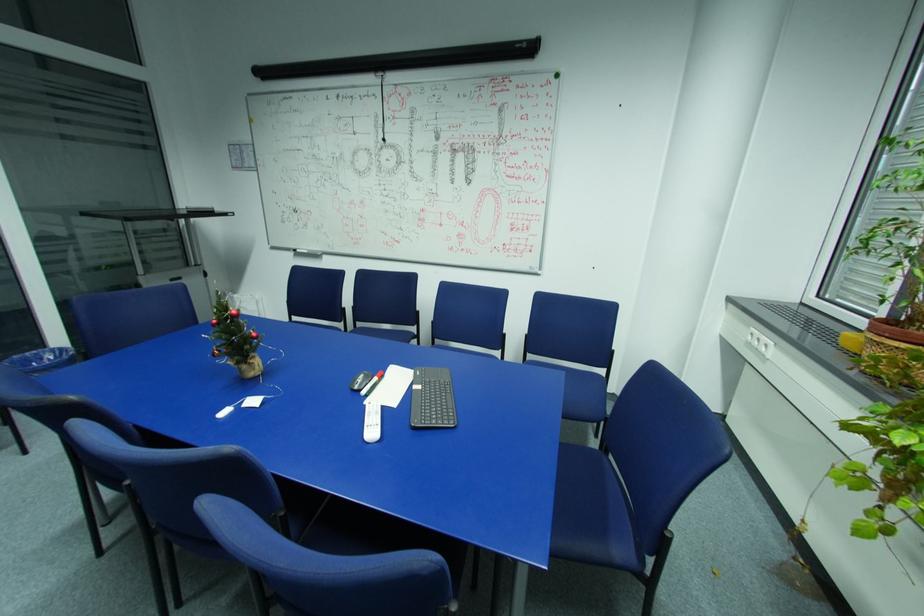
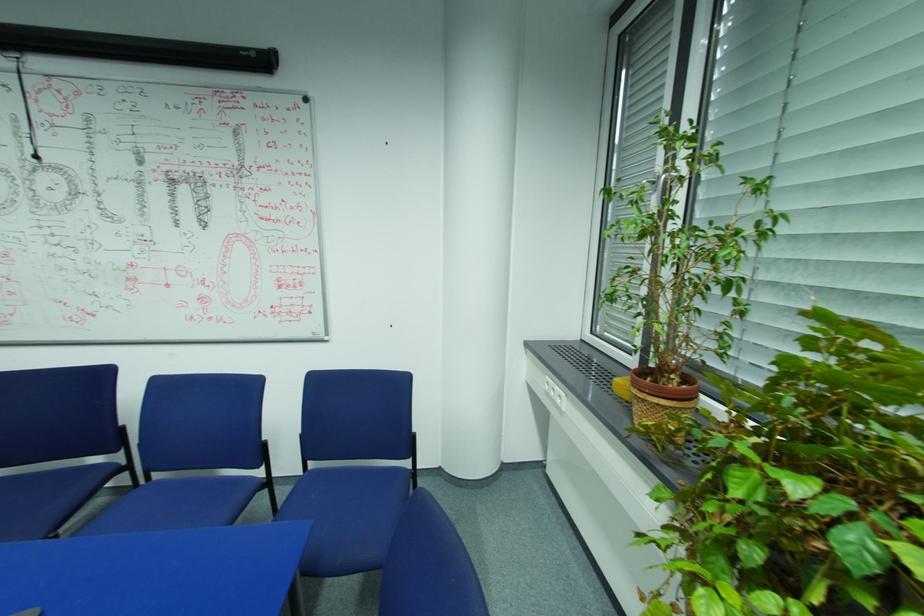
Question: The camera is either moving clockwise (left) or counter-clockwise (right) around the object. The first image is from the beginning of the video and the second image is from the end. Is the camera moving left or right when shooting the video?

Choices:
 (A) Left
 (B) Right

Answer: (A)